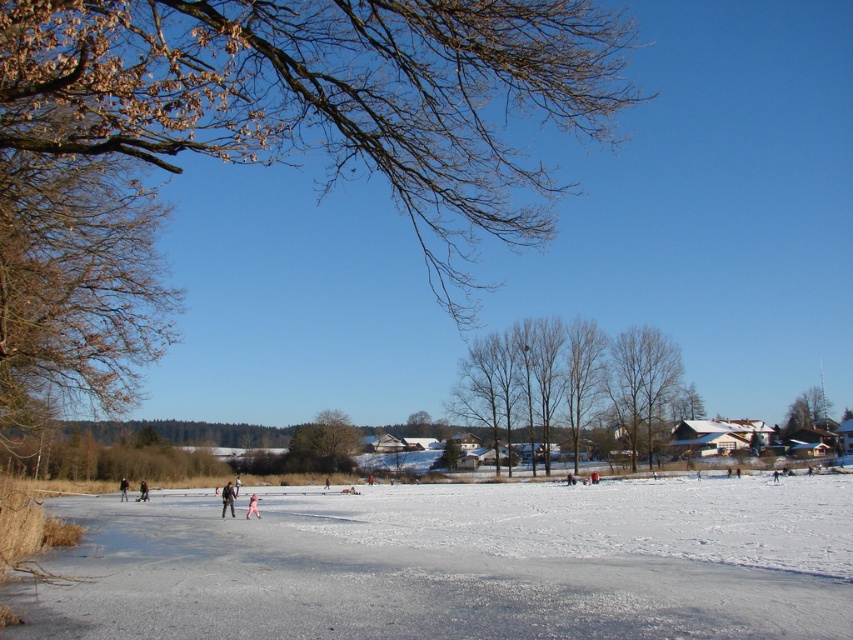
Question: Does smooth bark trees at center appear under dark blue jacket at left?

Choices:
 (A) yes
 (B) no

Answer: (B)

Question: Can you confirm if brown textured tree at center is smaller than brown rough tree at center?

Choices:
 (A) no
 (B) yes

Answer: (A)

Question: Does dark blue jacket at center appear over dark blue jacket at left?

Choices:
 (A) yes
 (B) no

Answer: (A)

Question: Which of the following is the farthest from the observer?

Choices:
 (A) (311, 440)
 (B) (579, 502)
 (C) (805, 400)
 (D) (577, 428)

Answer: (C)

Question: Among these objects, which one is farthest from the camera?

Choices:
 (A) dark brown leather jacket at lower left
 (B) dark blue jacket at left
 (C) brown textured tree at center

Answer: (C)

Question: Which is farther from the light pink fabric at center?

Choices:
 (A) green leafy tree at upper right
 (B) white smooth ice at center
 (C) smooth bark trees at center
 (D) dark blue jacket at left

Answer: (A)